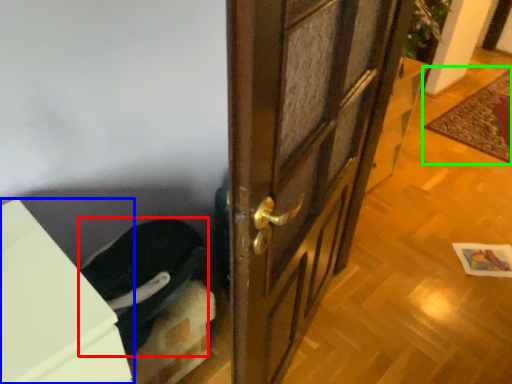
Question: Considering the real-world distances, which object is farthest from laundry (highlighted by a red box)? cabinetry (highlighted by a blue box) or doormat (highlighted by a green box)?

Choices:
 (A) cabinetry
 (B) doormat

Answer: (B)